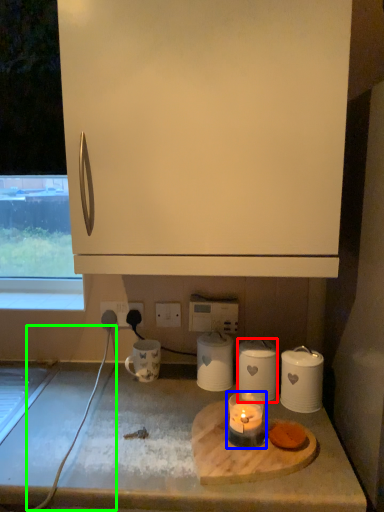
Question: Which is farther away from kitchen appliance (highlighted by a red box)? candle holder (highlighted by a blue box) or wire (highlighted by a green box)?

Choices:
 (A) candle holder
 (B) wire

Answer: (B)